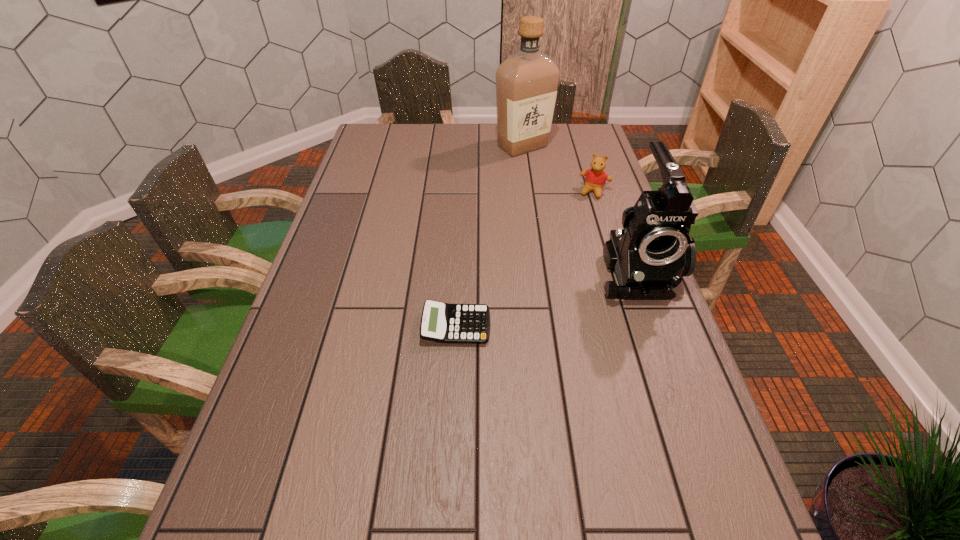
Find the location of `the shortest object`. the shortest object is located at coordinates (441, 322).

Identify the location of the nearest object. (441, 322).

Find the location of a particular element. camcorder is located at coordinates (649, 256).

Locate an element on the screen. The width and height of the screenshot is (960, 540). the second nearest object is located at coordinates (649, 256).

Locate an element on the screen. The image size is (960, 540). liquor is located at coordinates (527, 82).

The width and height of the screenshot is (960, 540). Find the location of `the second object from left to right`. the second object from left to right is located at coordinates (527, 82).

The height and width of the screenshot is (540, 960). Identify the location of teddy bear. (595, 179).

Find the location of `the second farthest object`. the second farthest object is located at coordinates (595, 179).

Identify the location of free region located on the right of the calculator. (634, 327).

What are the coordinates of `vacant space situated 0.110m on the lens mount of the camcorder` in the screenshot? It's located at (662, 341).